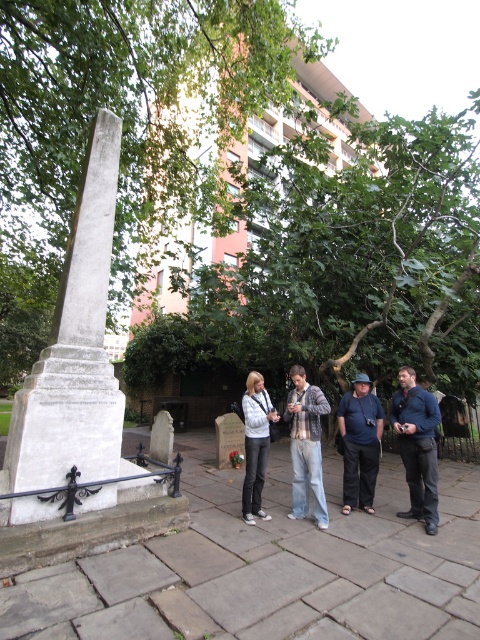
You are a photographer trying to capture a group photo of the blue denim jacket at lower right and the plaid shirt at center. To ensure both subjects are in frame, should you position yourself to the left or right of the group?

You should position yourself to the left of the group because the blue denim jacket at lower right is to the right of the plaid shirt at center, so placing yourself to the left will keep both subjects within the camera frame.

You are standing in the park and want to take a photo of the monument. The camera you have can focus on objects up to 5 meters away. Is the point at coordinates (409, 429) within the camera focus range?

The point at coordinates (409, 429) is 4.64 meters from the viewer, which is within the camera focus range of up to 5 meters. Yes, the camera can focus on that point.

Looking at this image, you are standing at the center of the paved stone pathway in the urban park or cemetery. You want to take a photo of the white stone obelisk at left. Which direction should you walk to get closer to the obelisk?

You should walk towards the left direction to get closer to the white stone obelisk at left since it is located at the left side of the frame.